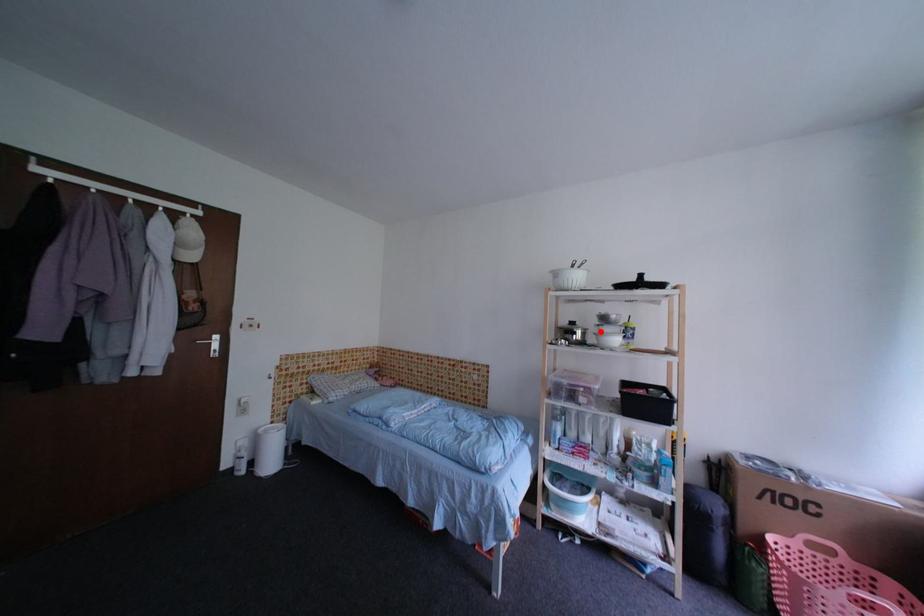
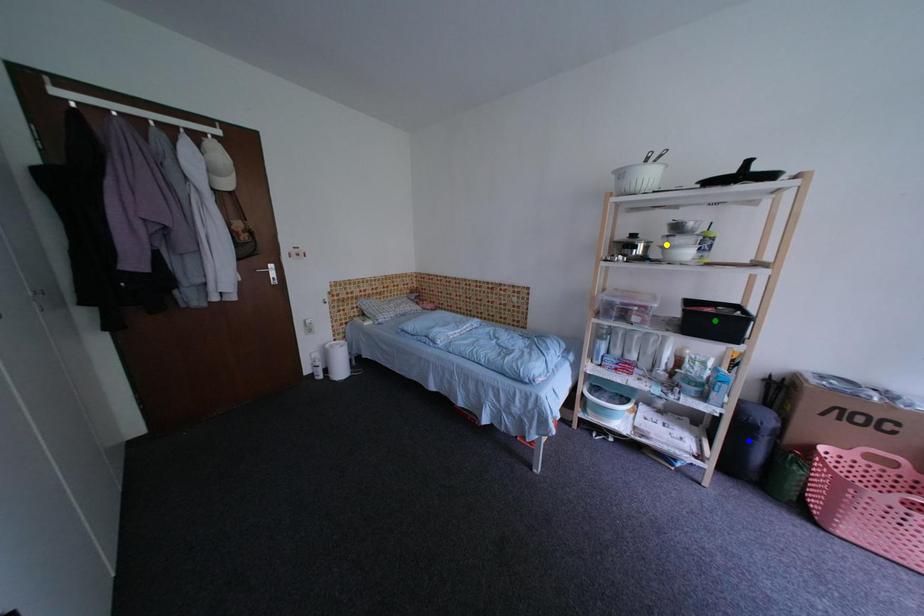
Question: I am providing you with two images of the same scene from different viewpoints. A red point is marked on the first image. You are given multiple points on the second image. Which spot in image 2 lines up with the point in image 1?

Choices:
 (A) blue point
 (B) yellow point
 (C) green point

Answer: (B)